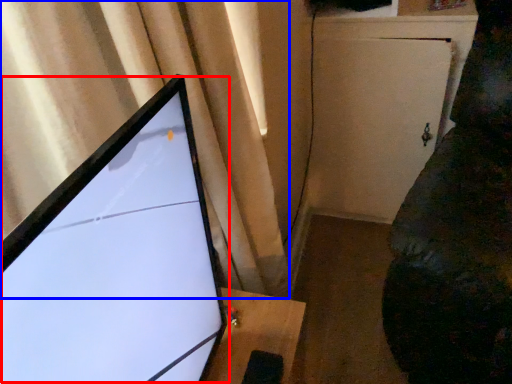
Question: Which point is closer to the camera, computer monitor (highlighted by a red box) or curtain (highlighted by a blue box)?

Choices:
 (A) computer monitor
 (B) curtain

Answer: (A)